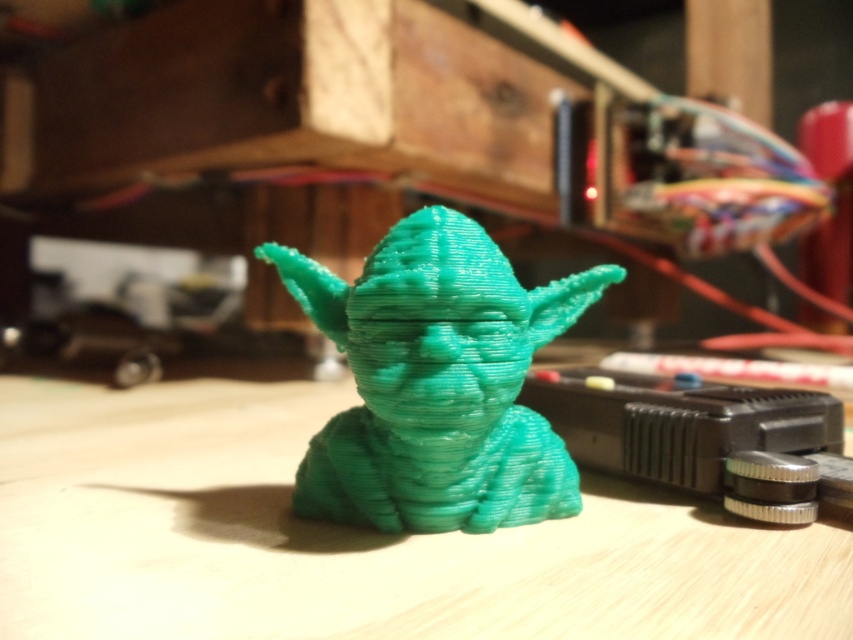
Question: Is green matte plastic yoda at center further to the viewer compared to teal matte yoda head at center?

Choices:
 (A) yes
 (B) no

Answer: (B)

Question: Which object is closer to the camera taking this photo?

Choices:
 (A) teal matte yoda head at center
 (B) green matte plastic yoda at center

Answer: (B)

Question: Can you confirm if green matte plastic yoda at center is positioned above teal matte yoda head at center?

Choices:
 (A) yes
 (B) no

Answer: (B)

Question: Which point is farther to the camera?

Choices:
 (A) green matte plastic yoda at center
 (B) teal matte yoda head at center

Answer: (B)

Question: Is green matte plastic yoda at center further to camera compared to teal matte yoda head at center?

Choices:
 (A) no
 (B) yes

Answer: (A)

Question: Which object appears closest to the camera in this image?

Choices:
 (A) green matte plastic yoda at center
 (B) teal matte yoda head at center

Answer: (A)